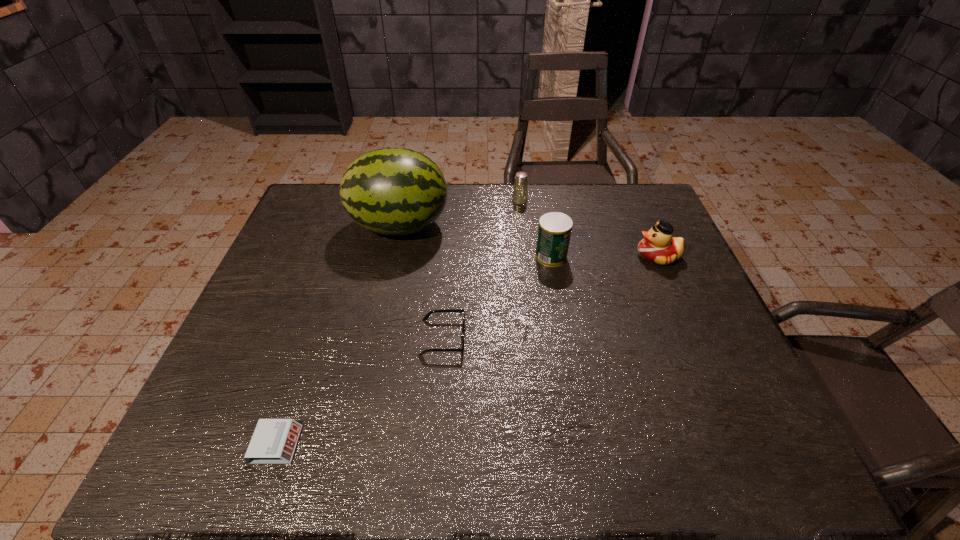
The width and height of the screenshot is (960, 540). What are the coordinates of `the tallest object` in the screenshot? It's located at (393, 191).

Where is `the second object from right to left`? the second object from right to left is located at coordinates (554, 231).

Find the location of a particular element. Image resolution: width=960 pixels, height=540 pixels. duck is located at coordinates tap(659, 246).

Locate an element on the screen. The height and width of the screenshot is (540, 960). the third object from right to left is located at coordinates (520, 192).

This screenshot has width=960, height=540. I want to click on the fifth farthest object, so click(x=428, y=314).

Locate an element on the screen. the second shortest object is located at coordinates (428, 314).

Identify the location of the nearest object. (274, 441).

This screenshot has height=540, width=960. In order to click on the shortest object in this screenshot , I will do `click(274, 441)`.

At what (x,y) coordinates should I click in order to perform the action: click on blank area located at the stem end of the watermelon. Please return your answer as a coordinate pair (x, y). This screenshot has width=960, height=540. Looking at the image, I should click on (531, 226).

Where is `free space located 0.310m on the right of the fifth object from left to right`? free space located 0.310m on the right of the fifth object from left to right is located at coordinates (675, 256).